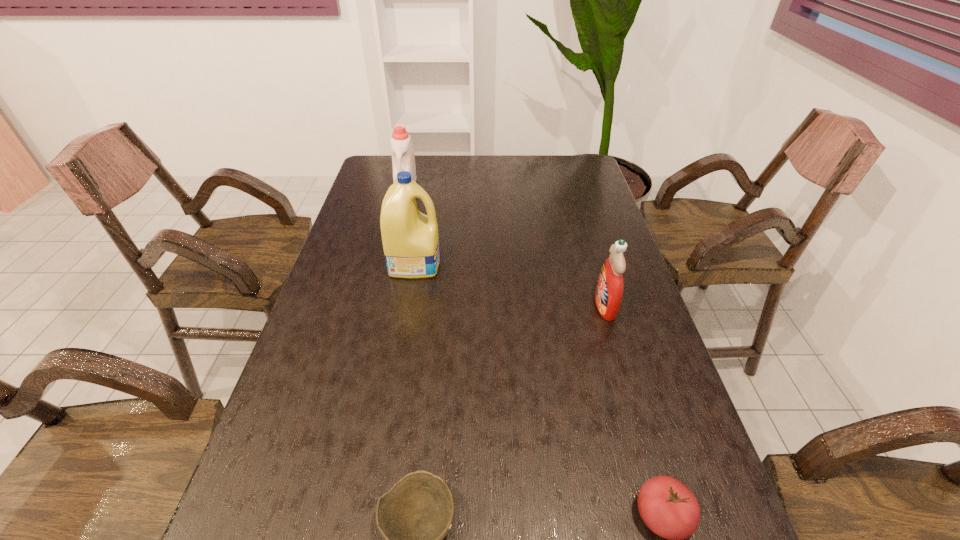
The image size is (960, 540). I want to click on object that is at the far edge, so click(x=403, y=159).

The width and height of the screenshot is (960, 540). Find the location of `object at the left edge`. object at the left edge is located at coordinates click(x=403, y=159).

The height and width of the screenshot is (540, 960). In order to click on object at the right edge in this screenshot , I will do `click(609, 290)`.

Where is `object that is at the far left corner`? object that is at the far left corner is located at coordinates (403, 159).

At what (x,y) coordinates should I click in order to perform the action: click on free region at the far edge of the desktop. Please return your answer as a coordinate pair (x, y). The image size is (960, 540). Looking at the image, I should click on (468, 159).

I want to click on vacant space at the left edge of the desktop, so click(x=376, y=223).

This screenshot has width=960, height=540. In order to click on free space at the right edge of the desktop in this screenshot , I will do `click(583, 261)`.

The height and width of the screenshot is (540, 960). In the image, there is a desktop. Find the location of `free region at the far left corner`. free region at the far left corner is located at coordinates (383, 180).

In the image, there is a desktop. Where is `blank space at the far right corner`? This screenshot has width=960, height=540. blank space at the far right corner is located at coordinates (567, 159).

Locate an element on the screen. The image size is (960, 540). unoccupied area between the second farthest detergent and the rightmost detergent is located at coordinates (510, 284).